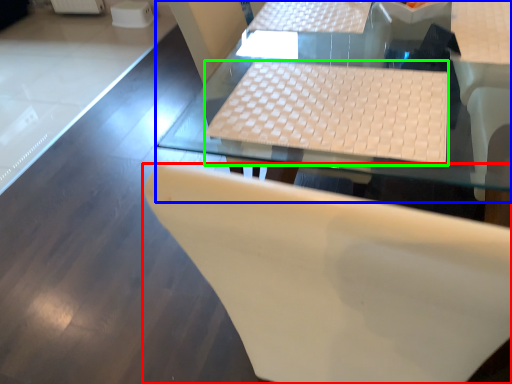
Question: Estimate the real-world distances between objects in this image. Which object is farther from chair (highlighted by a red box), table (highlighted by a blue box) or laptop keyboard (highlighted by a green box)?

Choices:
 (A) table
 (B) laptop keyboard

Answer: (A)